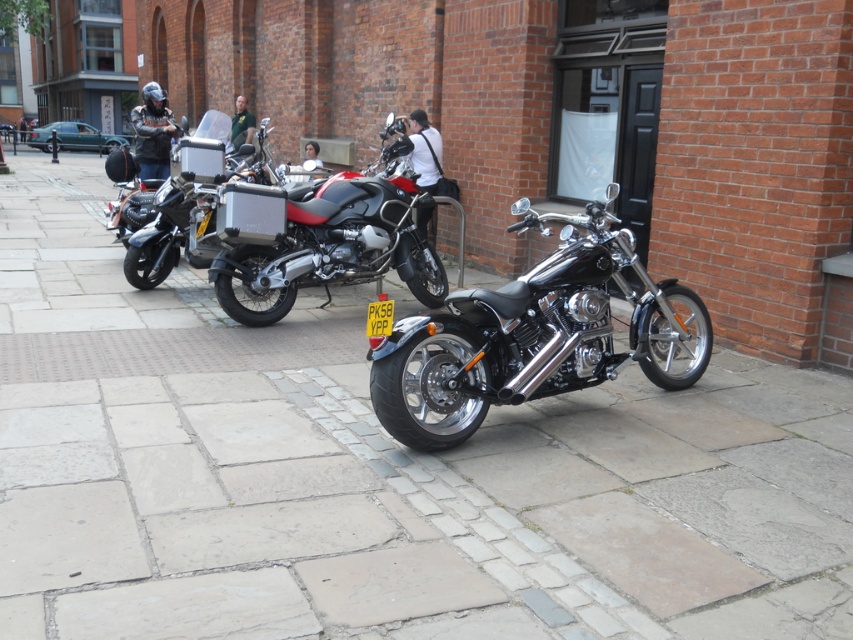
Does shiny chrome motorcycle at center have a lesser height compared to metallic silver motorcycle at center?

Yes.

Between point (460, 301) and point (309, 280), which one is positioned behind?

The point (309, 280) is behind.

You are a GUI agent. You are given a task and a screenshot of the screen. Output one action in this format:
    pyautogui.click(x=<x>, y=<y>)
    Task: Click on the shiny chrome motorcycle at center
    The width and height of the screenshot is (853, 640).
    Given the screenshot: What is the action you would take?
    pyautogui.click(x=534, y=336)

Who is positioned more to the right, metallic silver motorcycle at center or matte black motorcycle at center?

metallic silver motorcycle at center

Is metallic silver motorcycle at center thinner than matte black motorcycle at center?

In fact, metallic silver motorcycle at center might be wider than matte black motorcycle at center.

Is point (297, 268) in front of point (167, 186)?

Yes, point (297, 268) is in front of point (167, 186).

This screenshot has width=853, height=640. Find the location of `metallic silver motorcycle at center`. metallic silver motorcycle at center is located at coordinates (334, 244).

Can you confirm if shiny chrome motorcycle at center is bigger than matte black motorcycle at center?

Indeed, shiny chrome motorcycle at center has a larger size compared to matte black motorcycle at center.

Can you confirm if shiny chrome motorcycle at center is thinner than matte black motorcycle at center?

Incorrect, shiny chrome motorcycle at center's width is not less than matte black motorcycle at center's.

Which is in front, point (624, 253) or point (161, 230)?

Point (624, 253) is in front.

Image resolution: width=853 pixels, height=640 pixels. Find the location of `shiny chrome motorcycle at center`. shiny chrome motorcycle at center is located at coordinates (534, 336).